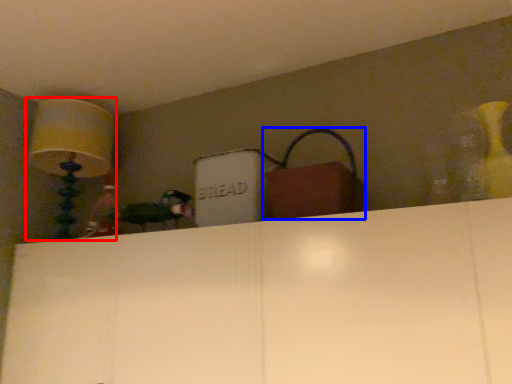
Question: Which object appears closest to the camera in this image, lamp (highlighted by a red box) or handbag (highlighted by a blue box)?

Choices:
 (A) lamp
 (B) handbag

Answer: (B)